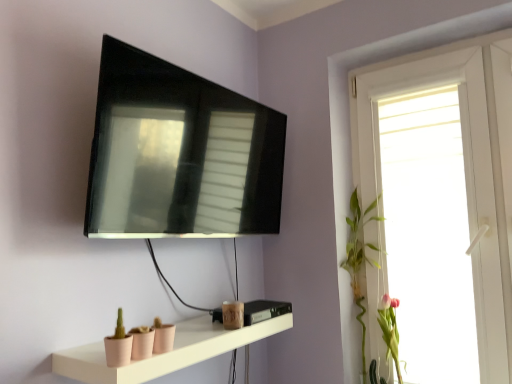
Question: From a real-world perspective, is pink matte flower at right, positioned as the second plant in left-to-right order, above or below matte pink shelf at lower center?

Choices:
 (A) above
 (B) below

Answer: (B)

Question: In the image, is pink matte flower at right, positioned as the second plant in left-to-right order, positioned in front of or behind matte pink shelf at lower center?

Choices:
 (A) behind
 (B) front

Answer: (A)

Question: Estimate the real-world distances between objects in this image. Which object is farther from the pink matte flower at right, positioned as the second plant in left-to-right order?

Choices:
 (A) matte black tv at upper center
 (B) matte pink shelf at lower center
 (C) green leafy plant at right, which is the second plant from right to left
 (D) white glossy window at upper right

Answer: (A)

Question: Based on their relative distances, which object is nearer to the matte black tv at upper center?

Choices:
 (A) white glossy window at upper right
 (B) matte pink shelf at lower center
 (C) green leafy plant at right, the 1th plant viewed from the left
 (D) pink matte flower at right, positioned as the 1th plant in right-to-left order

Answer: (B)